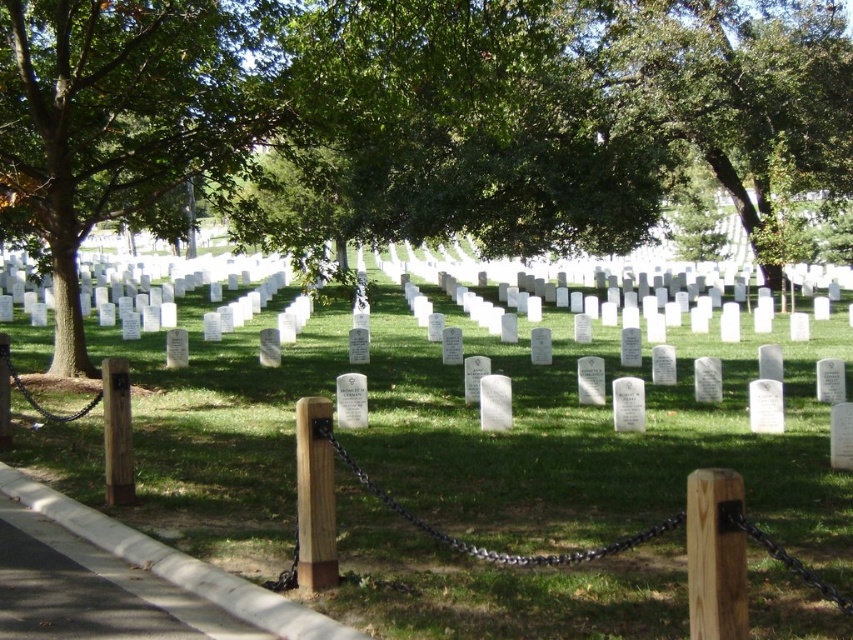
Question: Which point is closer to the camera?

Choices:
 (A) green leafy tree at upper center
 (B) green leafy tree at center
 (C) green grass at center

Answer: (C)

Question: Is green grass at center positioned before green leafy tree at upper center?

Choices:
 (A) yes
 (B) no

Answer: (A)

Question: In this image, where is green grass at center located relative to green leafy tree at upper center?

Choices:
 (A) left
 (B) right

Answer: (A)

Question: Which object is positioned closest to the green grass at center?

Choices:
 (A) green leafy tree at center
 (B) green leafy tree at upper center

Answer: (A)

Question: Can you confirm if green leafy tree at center is smaller than green grass at center?

Choices:
 (A) yes
 (B) no

Answer: (B)

Question: Which is nearer to the green grass at center?

Choices:
 (A) green leafy tree at center
 (B) green leafy tree at upper center

Answer: (A)